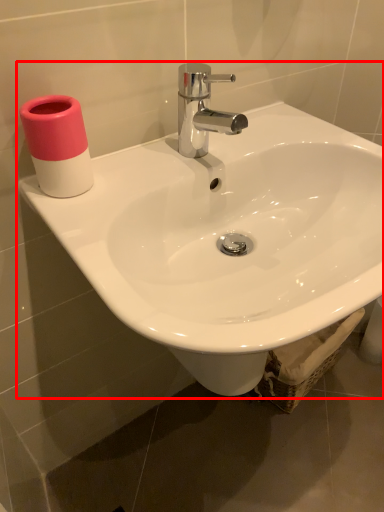
Question: From the image's perspective, where is sink (annotated by the red box) located relative to toiletry?

Choices:
 (A) below
 (B) above

Answer: (A)